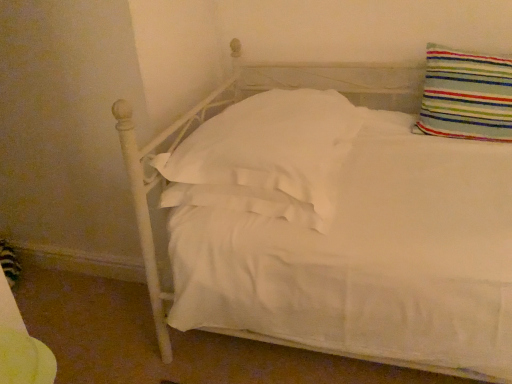
Question: Would you say striped fabric pillow at upper right, the second pillow positioned from the left, is inside or outside white soft pillow at center, which ranks as the second pillow in right-to-left order?

Choices:
 (A) outside
 (B) inside

Answer: (A)

Question: Considering the relative positions of striped fabric pillow at upper right, the 1th pillow viewed from the right, and white soft pillow at center, which ranks as the second pillow in right-to-left order, in the image provided, is striped fabric pillow at upper right, the 1th pillow viewed from the right, to the left or to the right of white soft pillow at center, which ranks as the second pillow in right-to-left order,?

Choices:
 (A) right
 (B) left

Answer: (A)

Question: In terms of size, does striped fabric pillow at upper right, the second pillow positioned from the left, appear bigger or smaller than white soft pillow at center, which ranks as the second pillow in right-to-left order?

Choices:
 (A) small
 (B) big

Answer: (A)

Question: Relative to striped fabric pillow at upper right, the 1th pillow viewed from the right, is white soft pillow at center, the first pillow positioned from the left, in front or behind?

Choices:
 (A) behind
 (B) front

Answer: (B)

Question: Does point (181, 162) appear closer or farther from the camera than point (492, 56)?

Choices:
 (A) closer
 (B) farther

Answer: (A)

Question: Is white soft pillow at center, the first pillow positioned from the left, taller or shorter than striped fabric pillow at upper right, the second pillow positioned from the left?

Choices:
 (A) short
 (B) tall

Answer: (A)

Question: In terms of size, does white soft pillow at center, which ranks as the second pillow in right-to-left order, appear bigger or smaller than striped fabric pillow at upper right, the 1th pillow viewed from the right?

Choices:
 (A) big
 (B) small

Answer: (A)